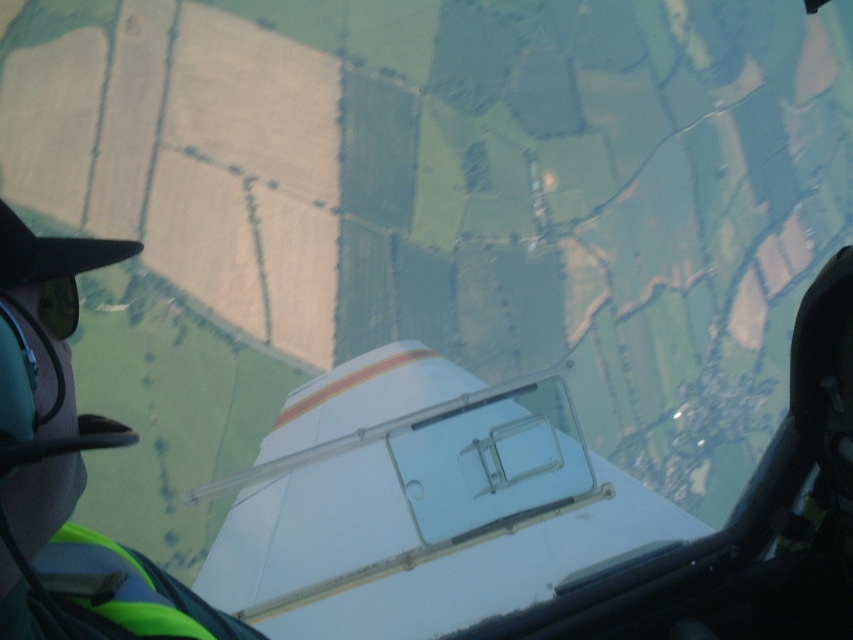
Question: Is the position of transparent plastic airplane window at center more distant than that of green matte goggles at lower left?

Choices:
 (A) yes
 (B) no

Answer: (A)

Question: Among these objects, which one is nearest to the camera?

Choices:
 (A) transparent plastic airplane window at center
 (B) white glossy airplane at center

Answer: (A)

Question: Which object is farther from the camera taking this photo?

Choices:
 (A) white glossy airplane at center
 (B) green fabric pilot at left

Answer: (A)

Question: Which point is closer to the camera taking this photo?

Choices:
 (A) (62, 605)
 (B) (527, 493)

Answer: (A)

Question: Can you confirm if white glossy airplane at center is positioned above green fabric pilot at left?

Choices:
 (A) yes
 (B) no

Answer: (B)

Question: Can you confirm if green fabric pilot at left is positioned to the right of green matte goggles at lower left?

Choices:
 (A) yes
 (B) no

Answer: (B)